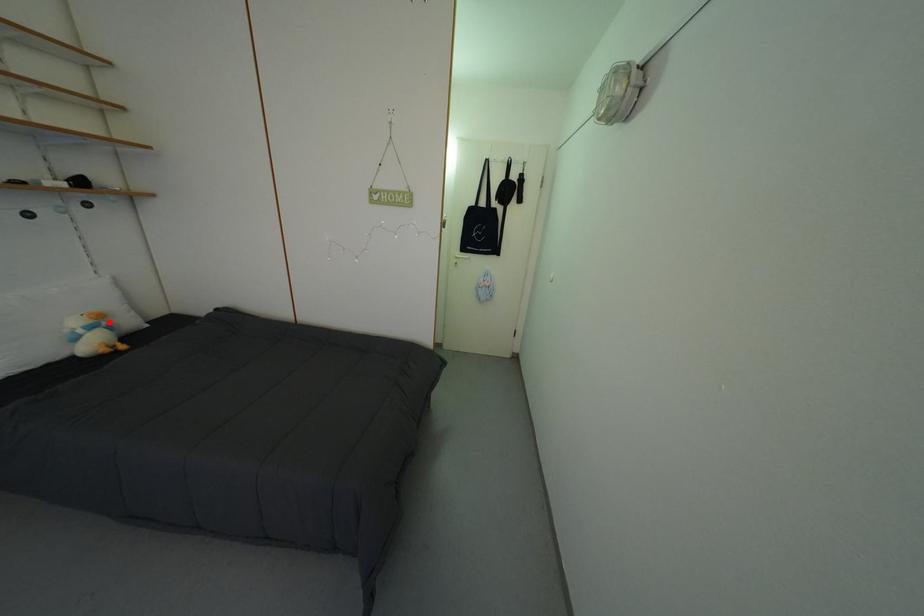
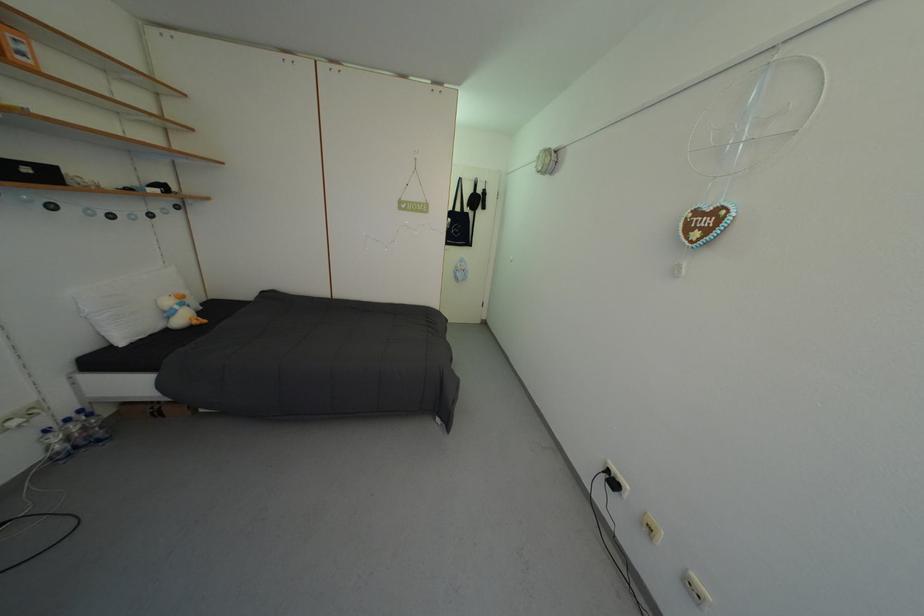
In the second image, find the point that corresponds to the highlighted location in the first image.

(190, 302)